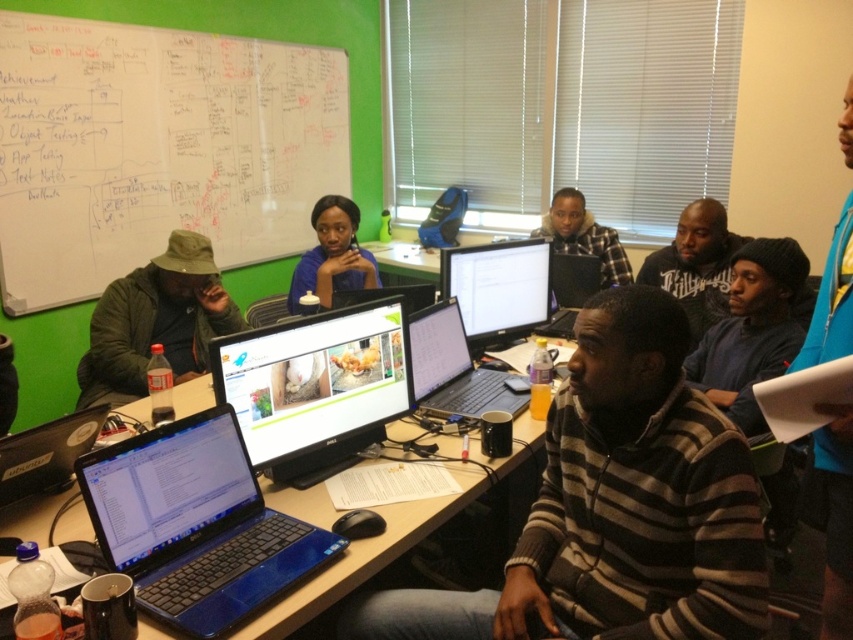
Which is more to the right, matte blue shirt at center or plaid fabric shirt at center?

plaid fabric shirt at center

Can you confirm if matte blue shirt at center is thinner than plaid fabric shirt at center?

Correct, matte blue shirt at center's width is less than plaid fabric shirt at center's.

Is point (341, 240) in front of point (544, 216)?

Yes, it is.

The image size is (853, 640). In order to click on matte blue shirt at center in this screenshot , I will do pos(332,256).

Is point (299, 400) farther from camera compared to point (322, 298)?

No, it is in front of (322, 298).

Does matte plastic monitor at center have a smaller size compared to matte blue shirt at center?

Correct, matte plastic monitor at center occupies less space than matte blue shirt at center.

Is point (329, 394) more distant than point (310, 266)?

No, (329, 394) is closer to viewer.

The image size is (853, 640). I want to click on matte plastic monitor at center, so click(315, 387).

This screenshot has width=853, height=640. I want to click on matte plastic monitor at center, so click(315, 387).

Based on the photo, does matte plastic monitor at center have a smaller size compared to plaid fabric shirt at center?

Indeed, matte plastic monitor at center has a smaller size compared to plaid fabric shirt at center.

Between point (318, 422) and point (552, 209), which one is positioned in front?

Point (318, 422) is more forward.

Image resolution: width=853 pixels, height=640 pixels. Identify the location of matte plastic monitor at center. (315, 387).